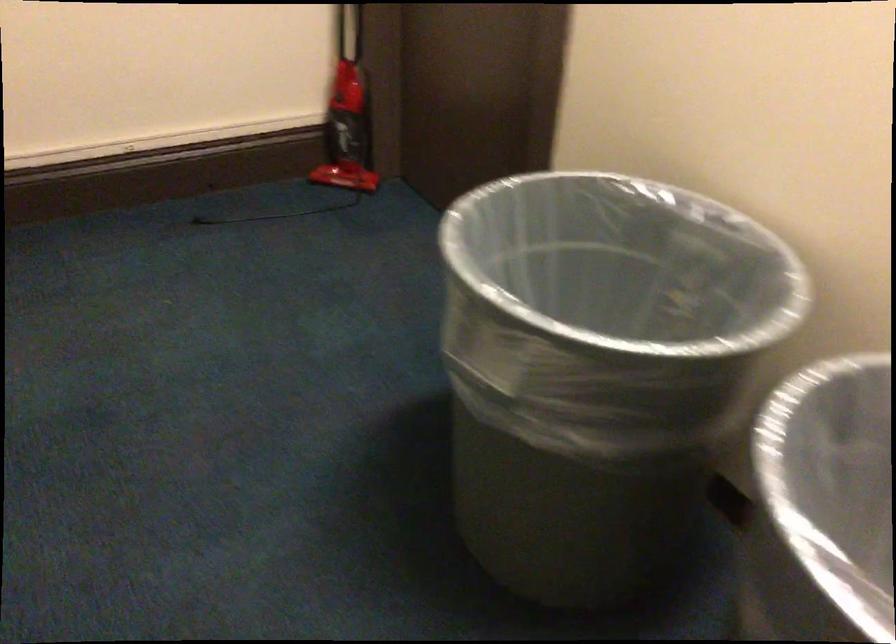
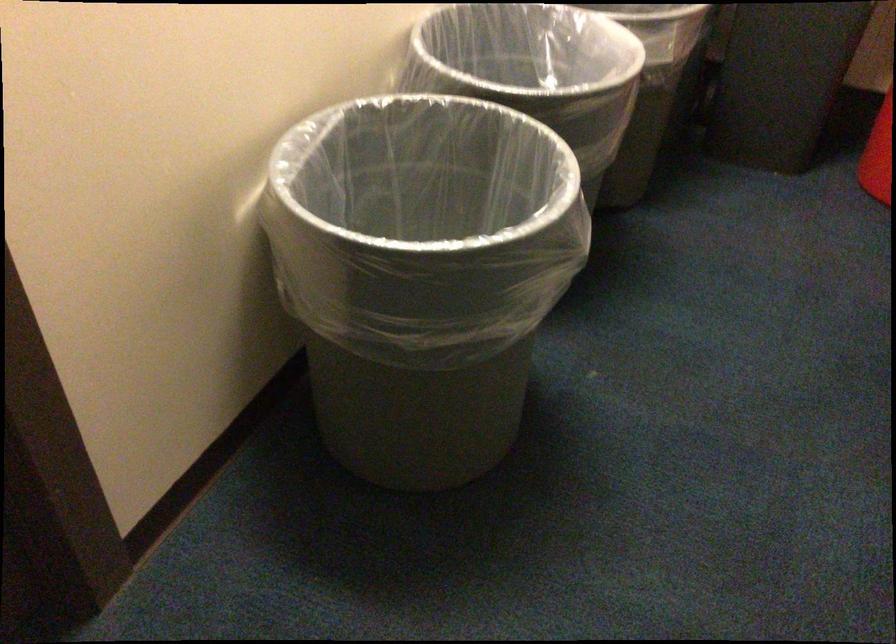
Where in the second image is the point corresponding to pixel 711 424 from the first image?

(410, 231)